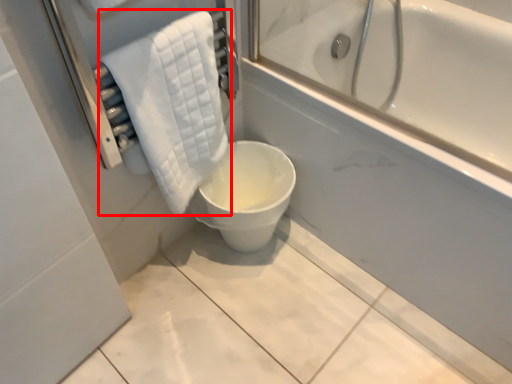
Question: Considering the relative positions of towel (annotated by the red box) and toilet in the image provided, where is towel (annotated by the red box) located with respect to the staircase?

Choices:
 (A) left
 (B) right

Answer: (A)